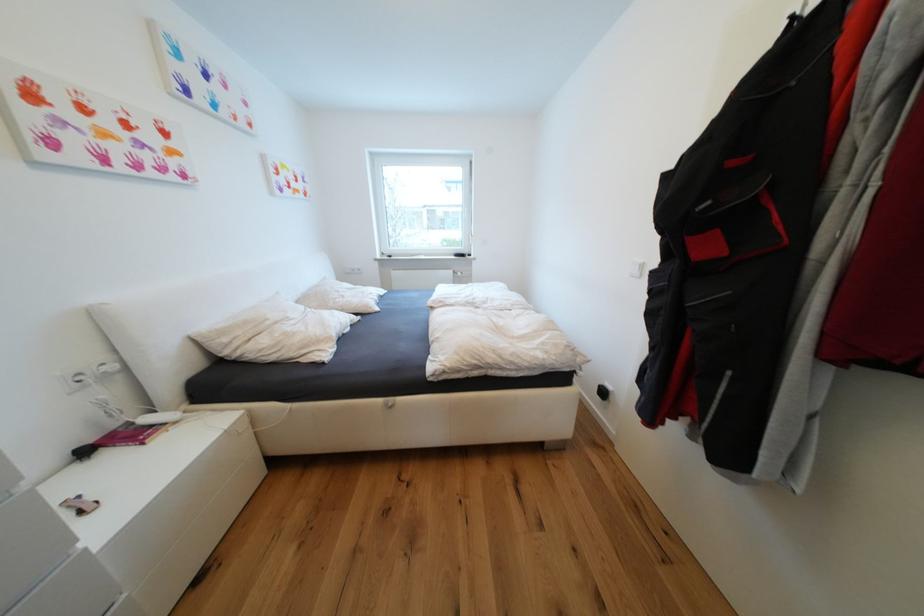
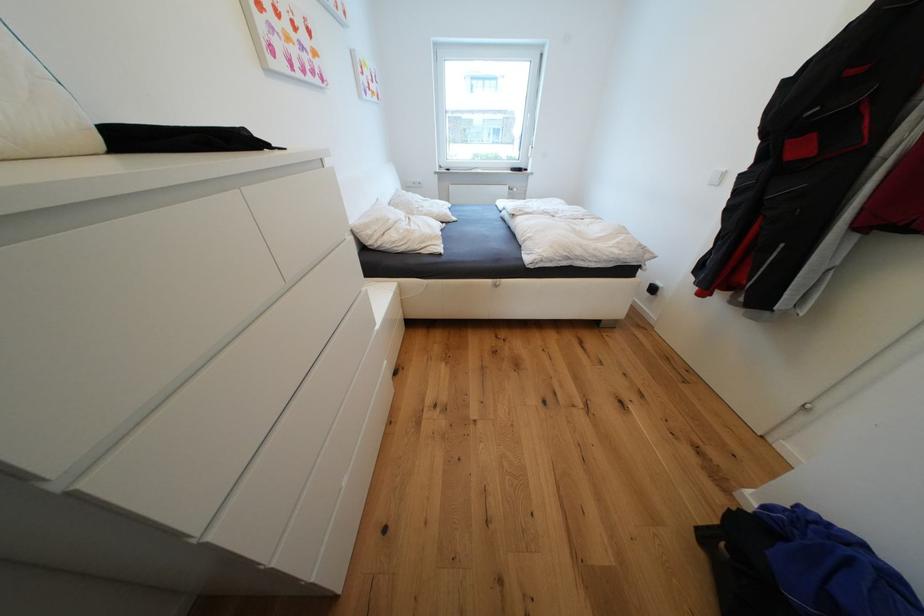
Find the pixel in the second image that matches point 448,302 in the first image.

(528, 212)